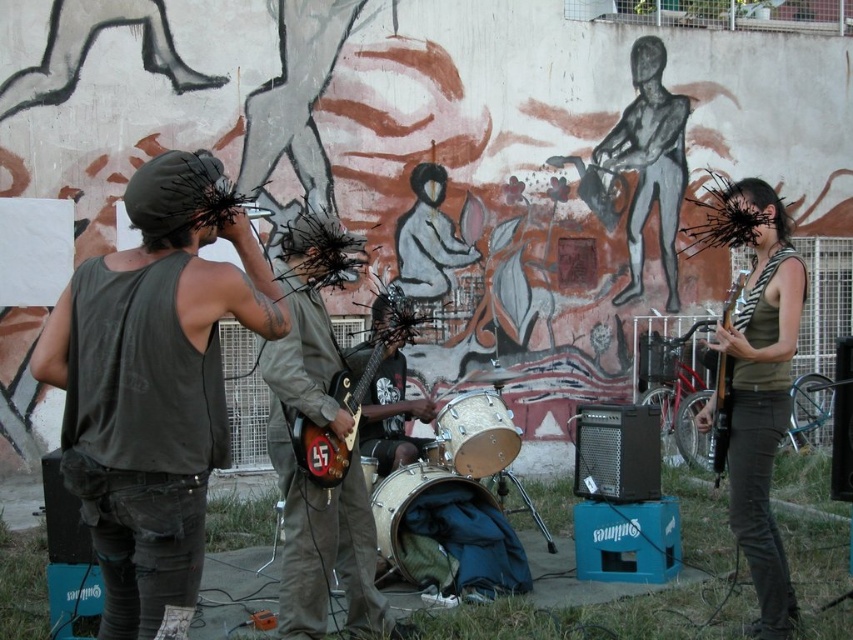
You are a photographer trying to capture a group shot of the performers. The matte olive green tank top at right and the black matte figure at center are positioned in the frame. Which performer should you adjust to make the group look more balanced in terms of visual weight?

Since the matte olive green tank top at right is narrower than the black matte figure at center, you should move the matte olive green tank top at right closer to the center to balance the visual weight between both performers.

You are setting up a music performance stage and need to place the camouflage fabric drum at center and the silver metallic drum at center side by side. Given that the stage has limited width, which drum should be placed first to ensure they both fit?

The silver metallic drum at center should be placed first because it has a smaller width than the camouflage fabric drum at center, allowing both to fit within the limited stage width.

You are a photographer standing at the point marked as point (310, 480). You want to capture the matte brown guitar at center in your shot. Is the matte brown guitar at center located exactly at your current position?

Yes, the matte brown guitar at center is located exactly at point (310, 480), which is your current position.